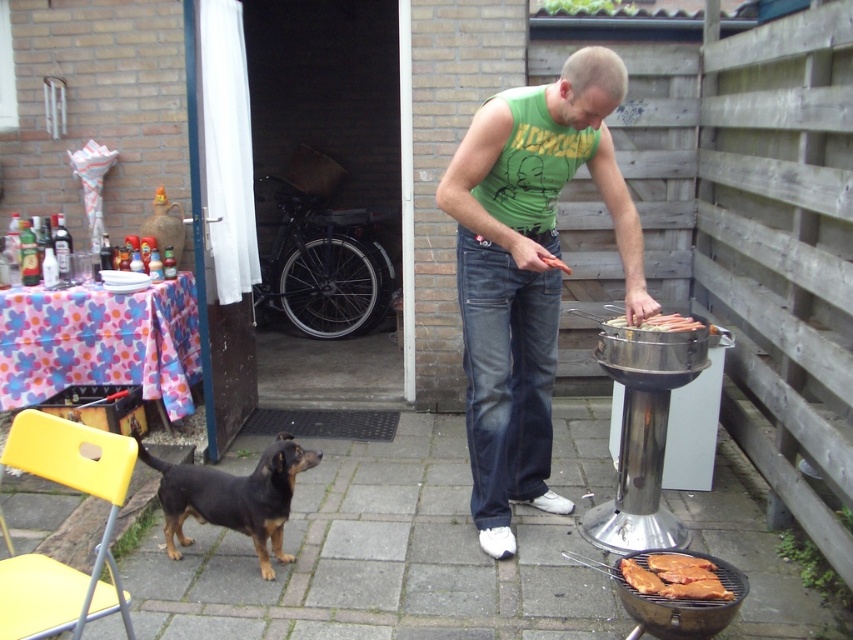
Who is higher up, brown textured meat at lower center or smooth silver grill at right?

smooth silver grill at right is above.

Is brown textured meat at lower center behind smooth silver grill at right?

That is False.

Image resolution: width=853 pixels, height=640 pixels. In order to click on brown textured meat at lower center in this screenshot , I will do `click(674, 577)`.

Can you confirm if brown/black fur dog at lower left is positioned to the left of brown textured meat at lower center?

Yes, brown/black fur dog at lower left is to the left of brown textured meat at lower center.

Describe the element at coordinates (233, 497) in the screenshot. I see `brown/black fur dog at lower left` at that location.

Find the location of a particular element. brown/black fur dog at lower left is located at coordinates (233, 497).

Can you confirm if yellow plastic chair at lower left is taller than smooth silver grill at right?

Indeed, yellow plastic chair at lower left has a greater height compared to smooth silver grill at right.

Which is below, yellow plastic chair at lower left or smooth silver grill at right?

yellow plastic chair at lower left is below.

Find the location of a particular element. The height and width of the screenshot is (640, 853). yellow plastic chair at lower left is located at coordinates (48, 556).

This screenshot has width=853, height=640. I want to click on yellow plastic chair at lower left, so click(x=48, y=556).